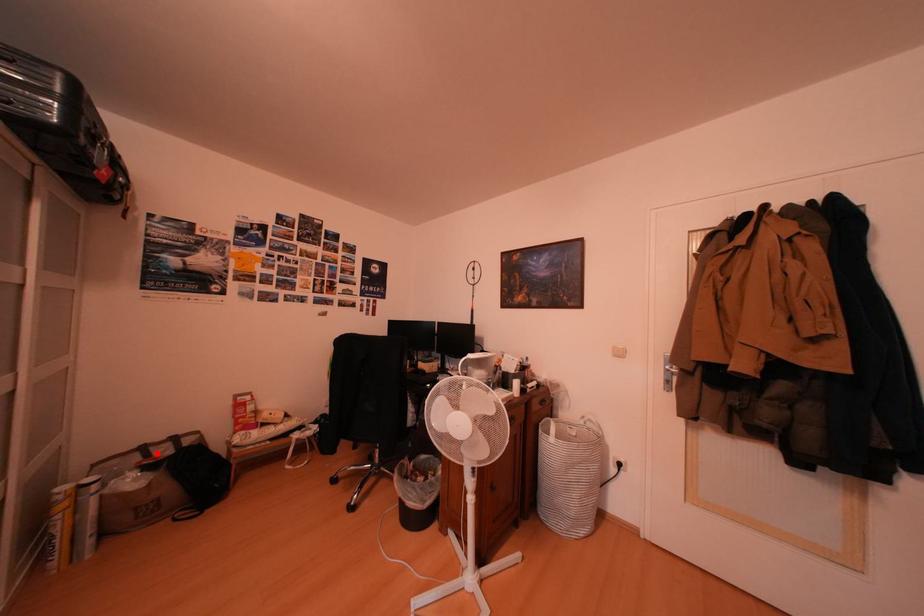
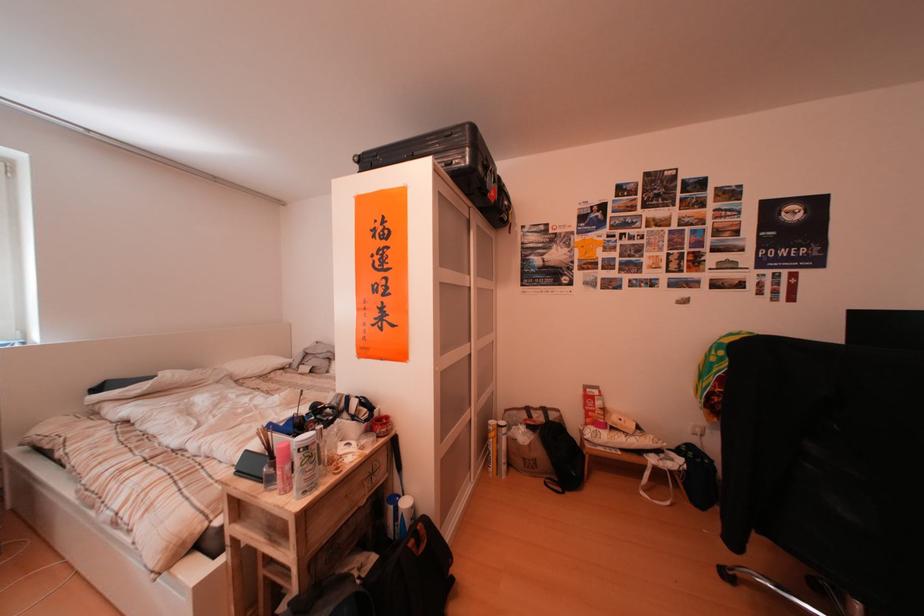
In the second image, find the point that corresponds to the highlighted location in the first image.

(541, 415)